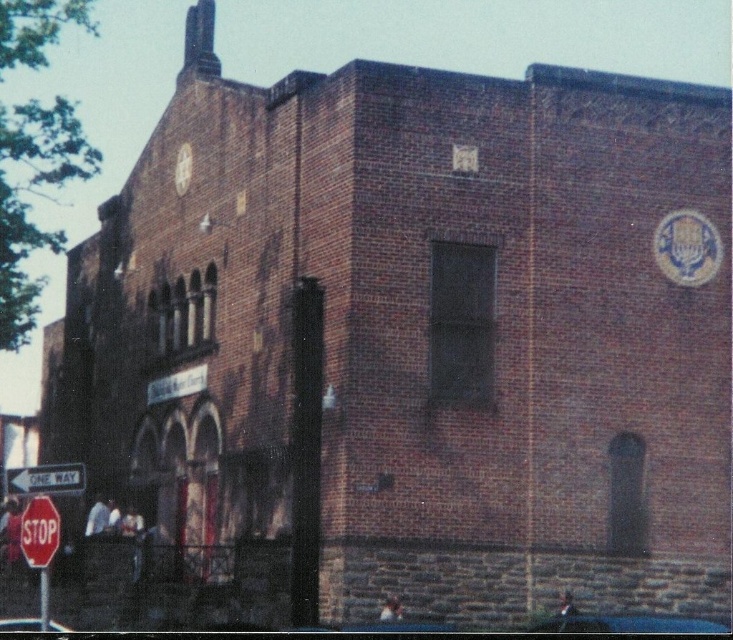
Question: Which object appears farthest from the camera in this image?

Choices:
 (A) white plastic one way sign at lower left
 (B) red glossy stop sign at lower left

Answer: (A)

Question: Is red glossy stop sign at lower left to the right of white plastic one way sign at lower left from the viewer's perspective?

Choices:
 (A) yes
 (B) no

Answer: (A)

Question: Which point is farther from the camera taking this photo?

Choices:
 (A) (56, 465)
 (B) (32, 500)

Answer: (A)

Question: Can you confirm if red glossy stop sign at lower left is positioned below white plastic one way sign at lower left?

Choices:
 (A) yes
 (B) no

Answer: (A)

Question: Among these points, which one is nearest to the camera?

Choices:
 (A) (43, 492)
 (B) (45, 541)

Answer: (B)

Question: Does red glossy stop sign at lower left have a greater width compared to white plastic one way sign at lower left?

Choices:
 (A) yes
 (B) no

Answer: (B)